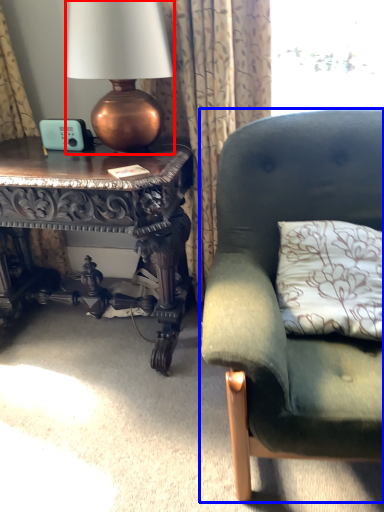
Question: Among these objects, which one is farthest to the camera, lamp (highlighted by a red box) or studio couch (highlighted by a blue box)?

Choices:
 (A) lamp
 (B) studio couch

Answer: (A)